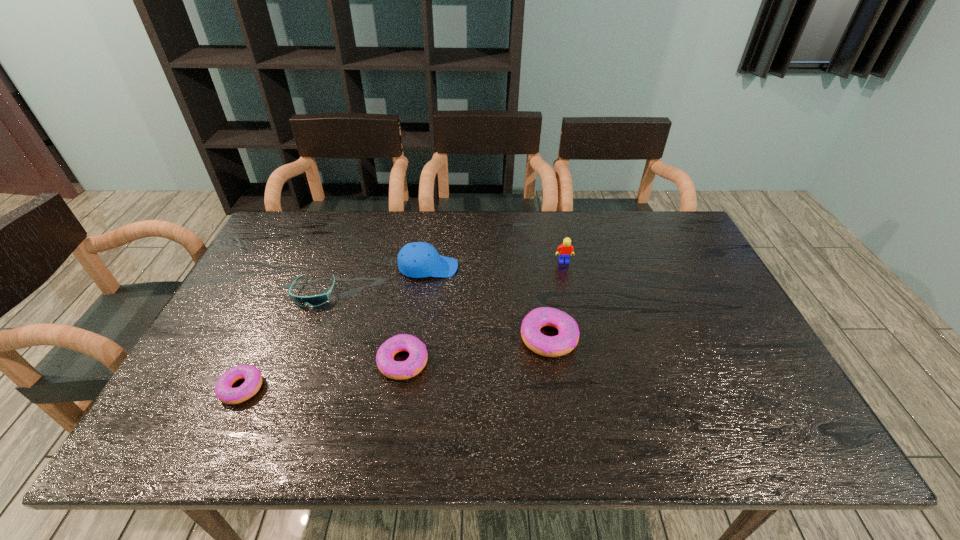
Please show where to add a doughnut on the right while keeping spacing even. Please provide its 2D coordinates. Your answer should be formatted as a tuple, i.e. [(x, y)], where the tuple contains the x and y coordinates of a point satisfying the conditions above.

[(681, 316)]